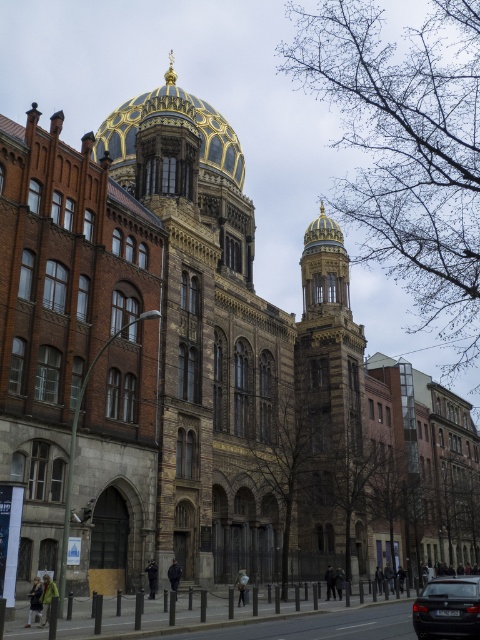
Who is positioned more to the right, gold mosaic dome at upper center or black glossy car at lower right?

black glossy car at lower right

Is point (212, 134) closer to viewer compared to point (478, 621)?

No, (212, 134) is further to viewer.

Describe the element at coordinates (192, 129) in the screenshot. I see `gold mosaic dome at upper center` at that location.

You are a GUI agent. You are given a task and a screenshot of the screen. Output one action in this format:
    pyautogui.click(x=<x>, y=<y>)
    Task: Click on the gold mosaic dome at upper center
    This screenshot has height=640, width=480.
    Given the screenshot: What is the action you would take?
    pyautogui.click(x=192, y=129)

Between point (418, 596) and point (315, 241), which one is positioned in front?

Point (418, 596) is more forward.

Is point (443, 592) positioned behind point (342, 243)?

No, (443, 592) is in front of (342, 243).

Where is `black glossy car at lower right`? black glossy car at lower right is located at coordinates (447, 609).

Locate an element on the screen. The image size is (480, 640). gold mosaic dome at upper center is located at coordinates (192, 129).

Is gold mosaic dome at upper center further to camera compared to goldmatte/goldendome at upper center?

That is False.

This screenshot has height=640, width=480. What do you see at coordinates (192, 129) in the screenshot?
I see `gold mosaic dome at upper center` at bounding box center [192, 129].

In order to click on gold mosaic dome at upper center in this screenshot , I will do `click(192, 129)`.